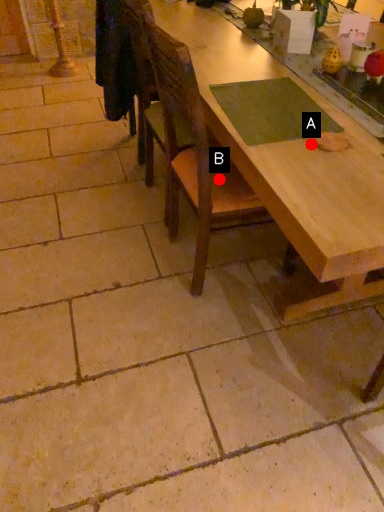
Question: Two points are circled on the image, labeled by A and B beside each circle. Which of the following is the farthest from the observer?

Choices:
 (A) A is further
 (B) B is further

Answer: (B)